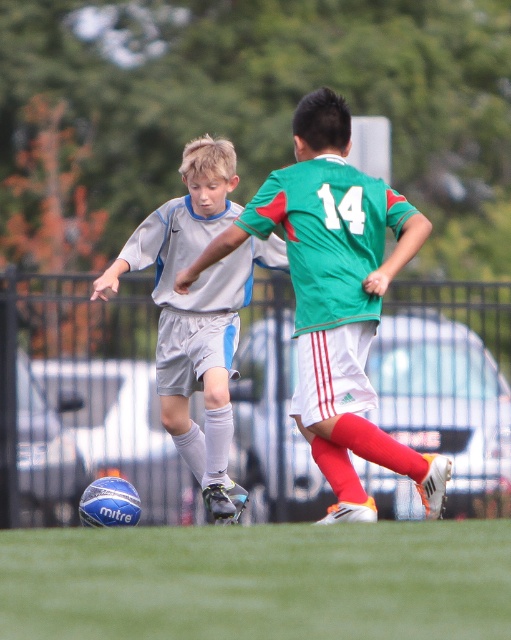
Question: Is green grass at center below green jersey at center?

Choices:
 (A) yes
 (B) no

Answer: (A)

Question: Considering the real-world distances, which object is closest to the green jersey at center?

Choices:
 (A) matte white soccer ball at lower left
 (B) green grass at center

Answer: (A)

Question: Is green grass at center further to the viewer compared to green jersey at center?

Choices:
 (A) no
 (B) yes

Answer: (A)

Question: Does green jersey at center have a larger size compared to matte white soccer ball at lower left?

Choices:
 (A) no
 (B) yes

Answer: (B)

Question: Which object is the farthest from the green jersey at center?

Choices:
 (A) matte white soccer ball at lower left
 (B) green grass at center

Answer: (B)

Question: Which of these objects is positioned farthest from the green jersey at center?

Choices:
 (A) matte white soccer ball at lower left
 (B) green grass at center

Answer: (B)